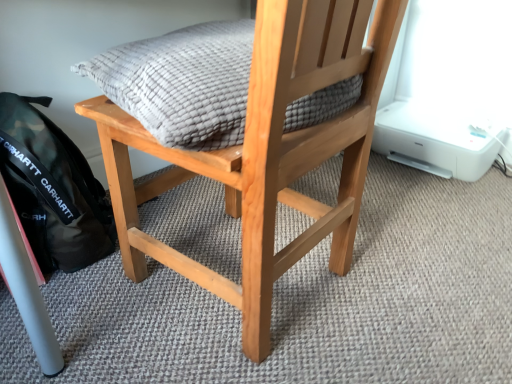
This screenshot has height=384, width=512. Identify the location of vacant space to the right of black matte backpack at lower left. (160, 263).